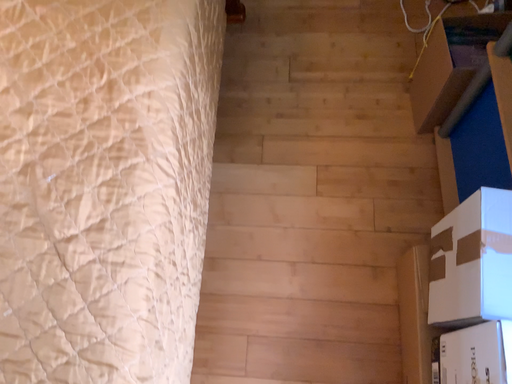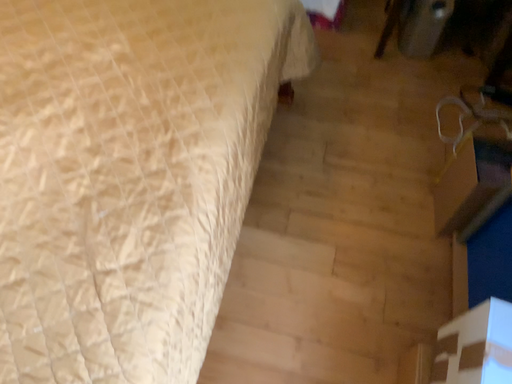
Question: Which way did the camera rotate in the video?

Choices:
 (A) rotated upward
 (B) rotated downward

Answer: (A)